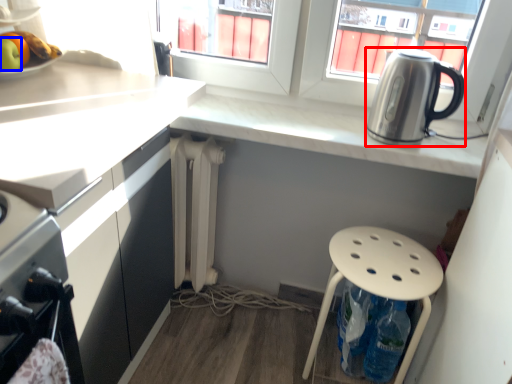
Question: Among these objects, which one is farthest to the camera, kitchen appliance (highlighted by a red box) or apple (highlighted by a blue box)?

Choices:
 (A) kitchen appliance
 (B) apple

Answer: (A)